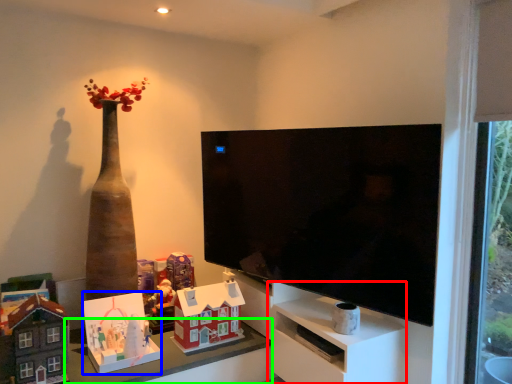
Question: Which object is the farthest from entertainment center (highlighted by a red box)? Choose among these: toy (highlighted by a blue box) or table (highlighted by a green box).

Choices:
 (A) toy
 (B) table

Answer: (A)